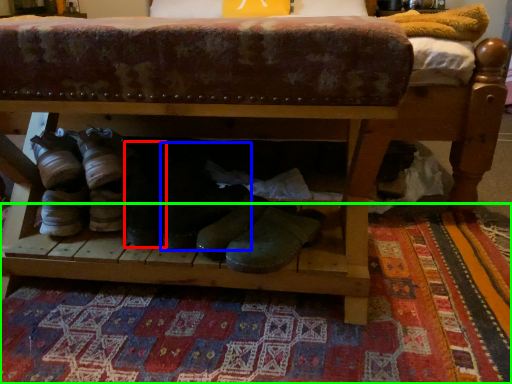
Question: Which object is positioned closest to footwear (highlighted by a red box)? Select from footwear (highlighted by a blue box) and mat (highlighted by a green box).

Choices:
 (A) footwear
 (B) mat

Answer: (A)